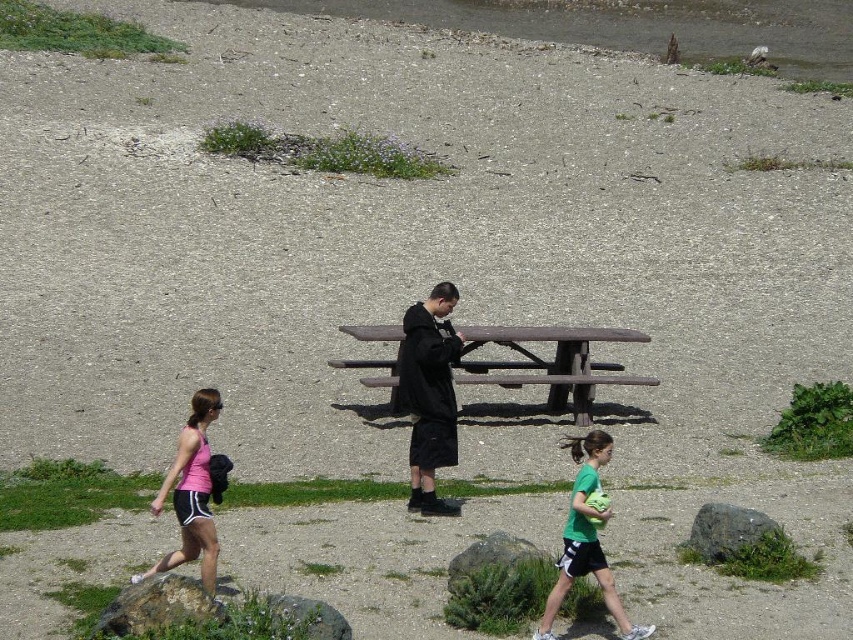
Question: Is green matte shirt at lower center to the right of gray rough rock at center from the viewer's perspective?

Choices:
 (A) yes
 (B) no

Answer: (B)

Question: Among these objects, which one is farthest from the camera?

Choices:
 (A) pink fabric tank top at lower left
 (B) green matte shirt at lower center
 (C) rough textured rock at lower left

Answer: (A)

Question: Which of the following is the farthest from the observer?

Choices:
 (A) gray rock at lower center
 (B) pink fabric tank top at lower left

Answer: (A)

Question: Can you confirm if pink fabric tank top at lower left is positioned to the left of rough textured rock at lower left?

Choices:
 (A) yes
 (B) no

Answer: (A)

Question: Which of the following is the closest to the observer?

Choices:
 (A) (593, 534)
 (B) (526, 332)

Answer: (A)

Question: Can you confirm if brown wooden bench at center is positioned to the left of gray rough rock at center?

Choices:
 (A) no
 (B) yes

Answer: (B)